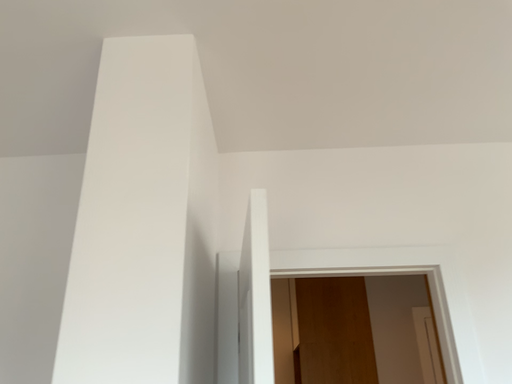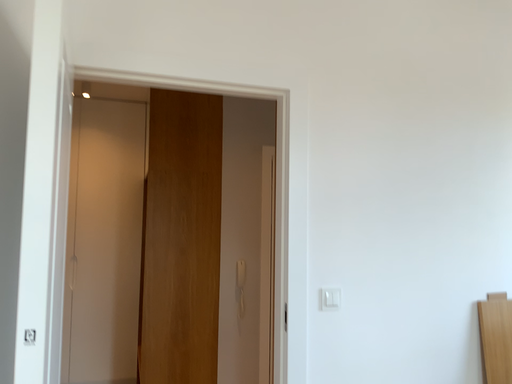
Question: How did the camera likely rotate when shooting the video?

Choices:
 (A) rotated left
 (B) rotated right

Answer: (B)